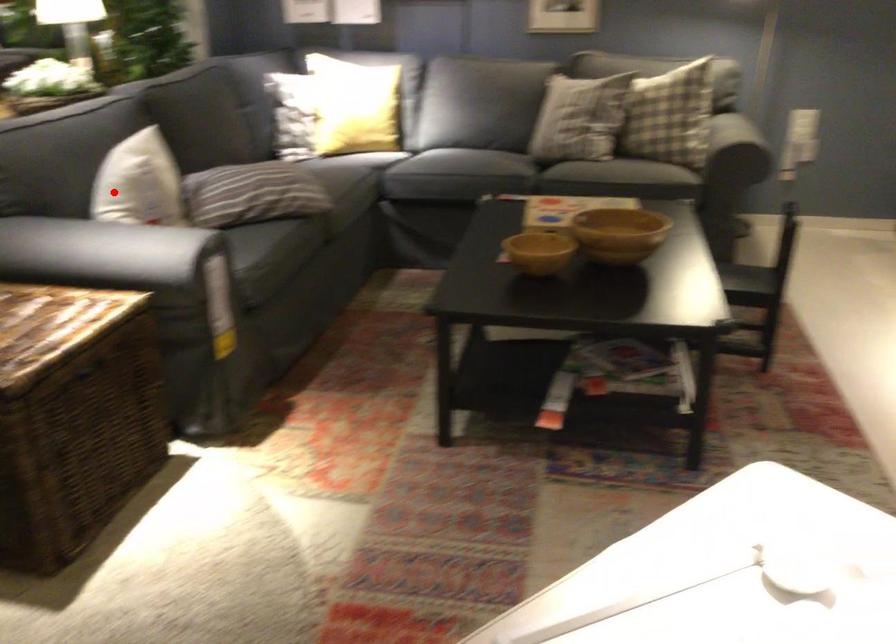
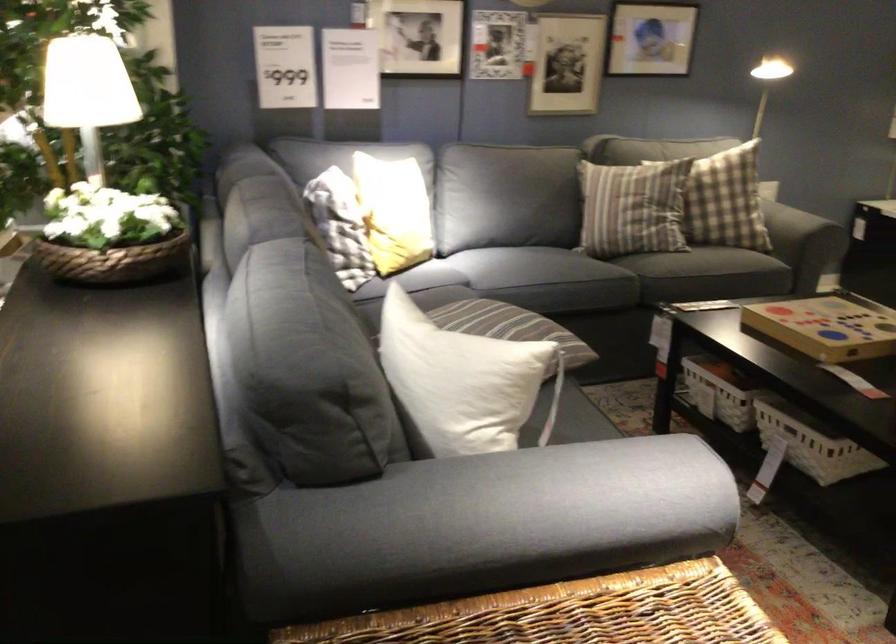
Locate, in the second image, the point that corresponds to the highlighted location in the first image.

(462, 381)